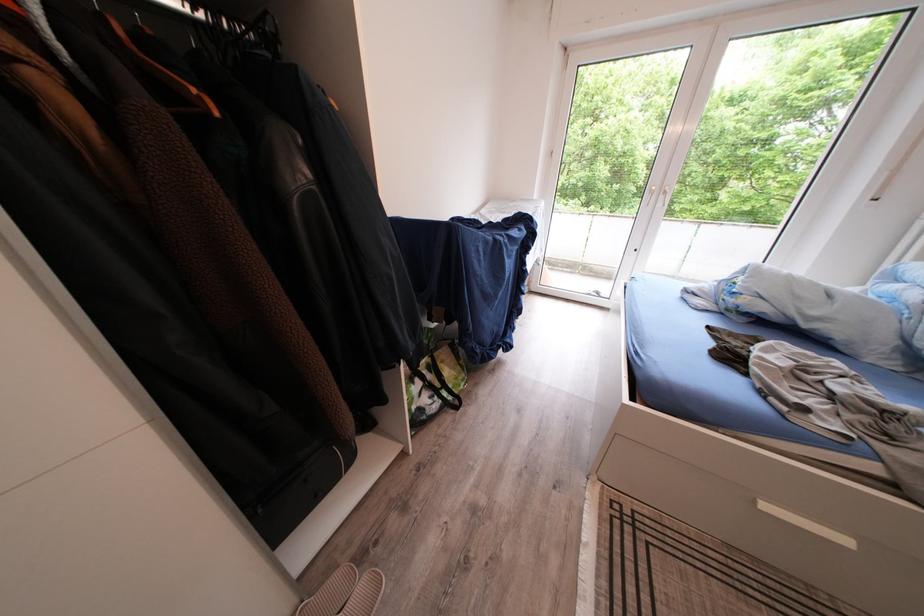
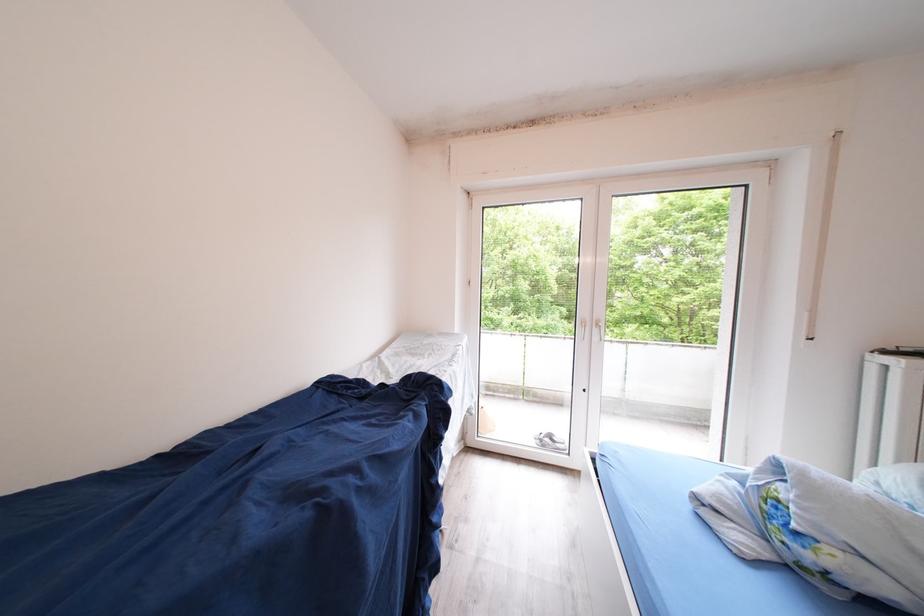
The images are taken continuously from a first-person perspective. In which direction are you moving?

The cameraman moved toward right, forward.